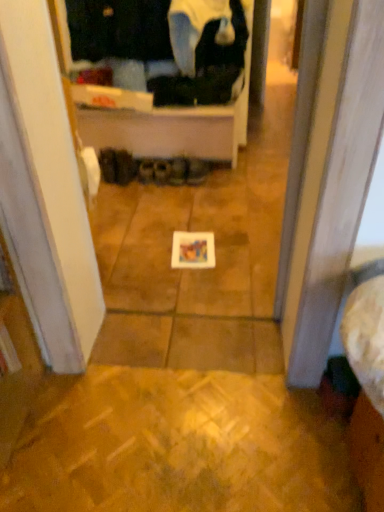
Question: Would you say brown suede shoes at center, which ranks as the third footwear in right-to-left order, is inside or outside leather brown shoes at center, which is counted as the first footwear, starting from the right?

Choices:
 (A) inside
 (B) outside

Answer: (B)

Question: Looking at their shapes, would you say brown suede shoes at center, which ranks as the third footwear in right-to-left order, is wider or thinner than leather brown shoes at center, which is counted as the first footwear, starting from the right?

Choices:
 (A) wide
 (B) thin

Answer: (B)

Question: Estimate the real-world distances between objects in this image. Which object is closer to the matte black shoes at center, the second footwear from the right?

Choices:
 (A) brown suede boot at center, the 2th footwear in the left-to-right sequence
 (B) brown suede shoes at center, which ranks as the third footwear in right-to-left order
 (C) black fabric shoes at center, which is counted as the sixth footwear, starting from the right
 (D) leather brown shoes at center, the sixth footwear from the left
 (E) black fabric shoes at center, the 3th footwear when ordered from left to right

Answer: (D)

Question: Estimate the real-world distances between objects in this image. Which object is closer to the black fabric at upper center?

Choices:
 (A) black fabric shoes at center, which is counted as the sixth footwear, starting from the right
 (B) leather brown shoes at center, which is counted as the first footwear, starting from the right
 (C) brown suede boot at center, the 2th footwear in the left-to-right sequence
 (D) matte black shoes at center, the 5th footwear when ordered from left to right
 (E) brown suede shoes at center, which ranks as the fourth footwear in left-to-right order

Answer: (C)